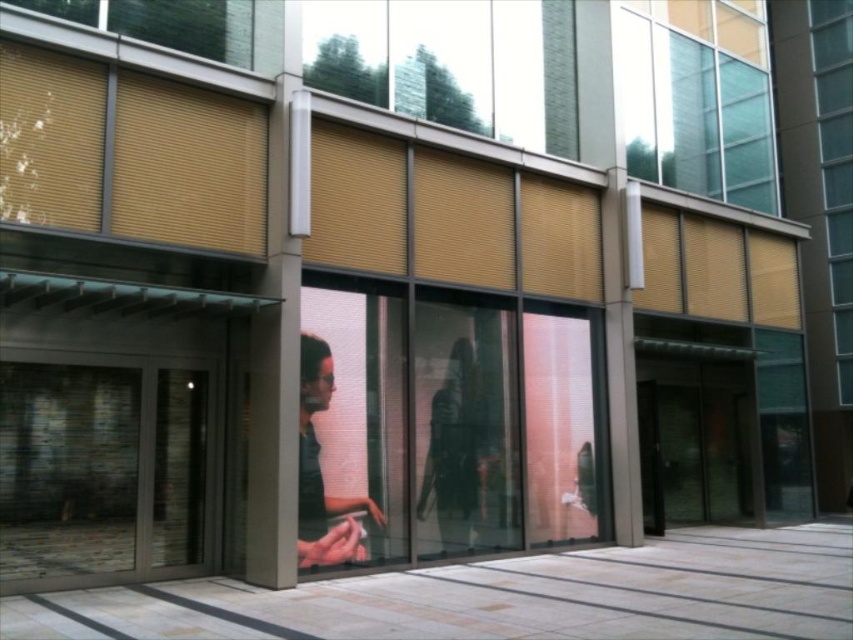
Question: Estimate the real-world distances between objects in this image. Which object is farther from the matte glass window at right?

Choices:
 (A) matte black jacket at center
 (B) transparent glass door at center

Answer: (A)

Question: Which point is closer to the camera?

Choices:
 (A) translucent glass window at upper right
 (B) transparent glass window at upper center

Answer: (B)

Question: Can you confirm if transparent glass door at left is thinner than transparent glass door at center?

Choices:
 (A) no
 (B) yes

Answer: (B)

Question: Does translucent glass window at upper right have a lesser width compared to matte black jacket at center?

Choices:
 (A) no
 (B) yes

Answer: (A)

Question: Which of the following is the farthest from the observer?

Choices:
 (A) (376, 36)
 (B) (316, 412)
 (C) (822, 74)
 (D) (676, 45)

Answer: (C)

Question: Does transparent glass door at center lie in front of matte glass window at right?

Choices:
 (A) no
 (B) yes

Answer: (B)